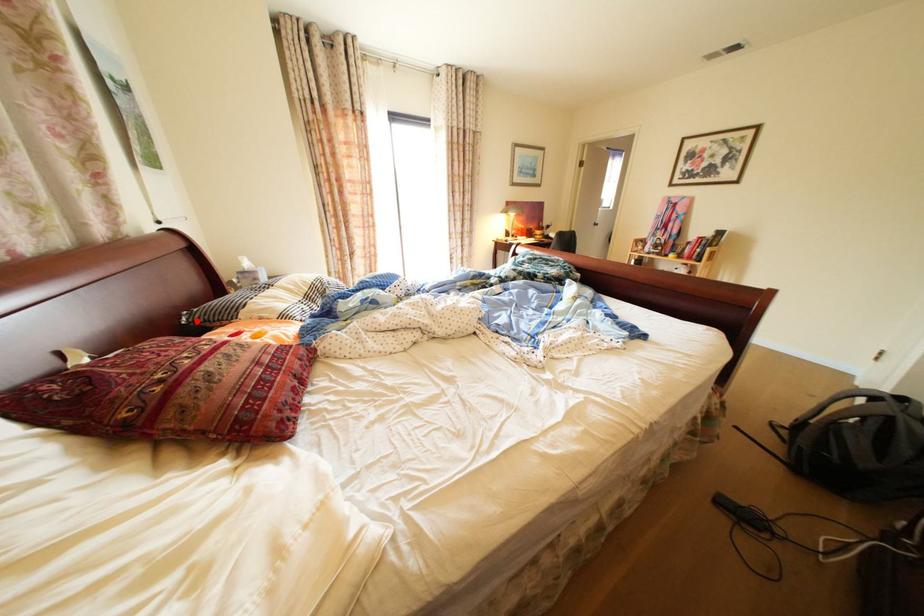
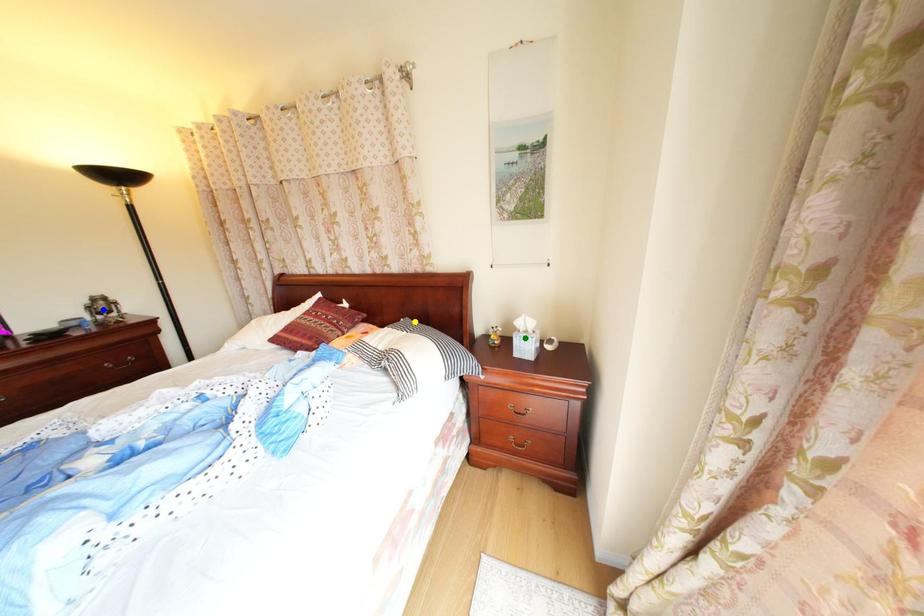
Question: I am providing you with two images of the same scene from different viewpoints. A red point is marked on the first image. You are given multiple points on the second image. Which point in image 2 is actually the same real-world point as the red point in image 1?

Choices:
 (A) green point
 (B) blue point
 (C) yellow point

Answer: (C)